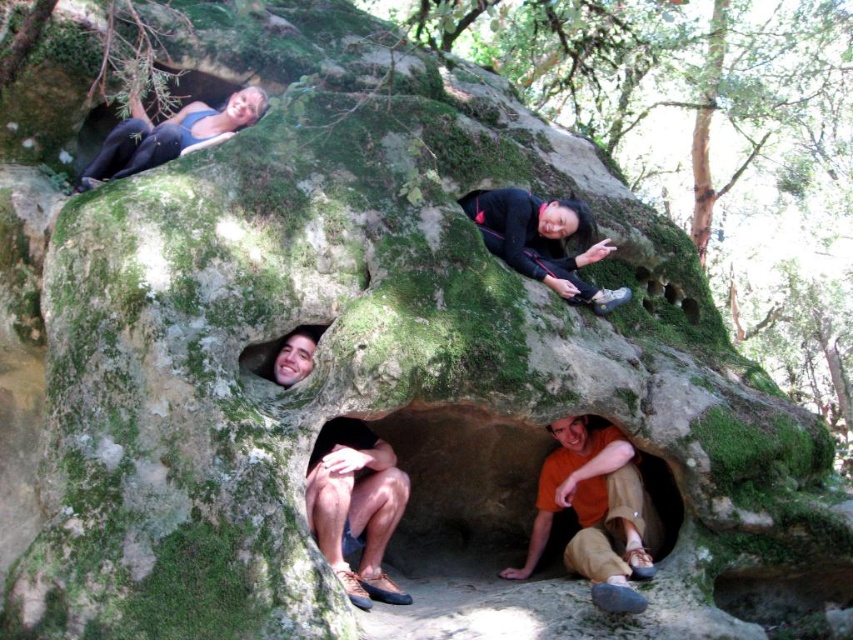
You are standing in front of the mossy rock formation and want to place a small flag at each of the two points marked as point (583, 522) and point (364, 540). Which point is closer to you so that you can easily reach it without moving your position?

Point (583, 522) is further to the camera than point (364, 540), so the closer point to you is point (364, 540). You can easily reach it without moving your position.

You are a photographer trying to capture a photo of the matte black tank top at upper left and the smooth skin face at center. Which object should you focus on first if you want to ensure both are in focus without moving the camera? Explain your reasoning based on their positions.

The matte black tank top at upper left is wider than the smooth skin face at center. To ensure both are in focus, you should focus on the matte black tank top at upper left first because it is wider, allowing the depth of field to cover the closer smooth skin face at center.